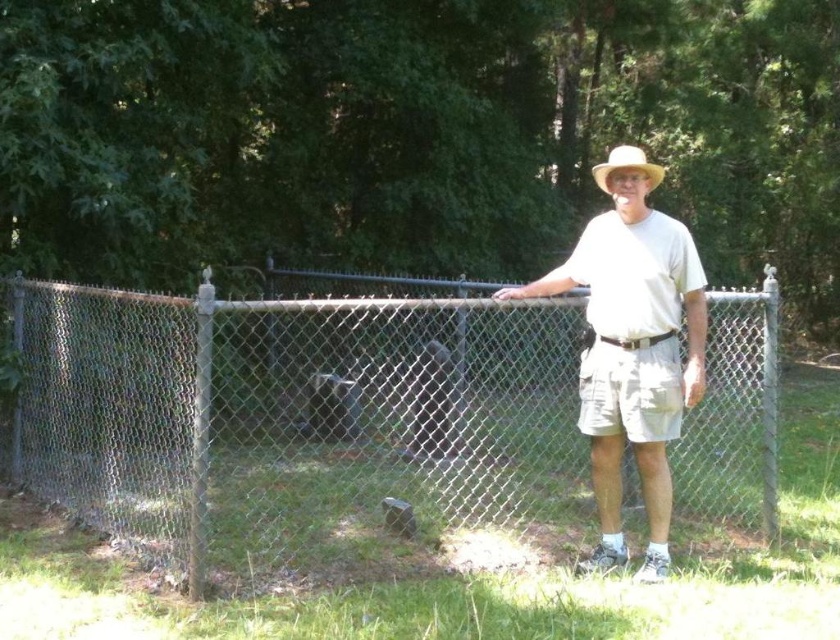
Question: From the image, what is the correct spatial relationship of silver chain-link fence at center in relation to white cotton shirt at center?

Choices:
 (A) above
 (B) below

Answer: (B)

Question: Which object is positioned farthest from the white cotton shirt at center?

Choices:
 (A) light brown straw hat at center
 (B) silver chain-link fence at center

Answer: (A)

Question: Is silver chain-link fence at center bigger than white cotton shirt at center?

Choices:
 (A) yes
 (B) no

Answer: (B)

Question: Which point is closer to the camera?

Choices:
 (A) white cotton shirt at center
 (B) silver chain-link fence at center
 (C) light brown straw hat at center

Answer: (C)

Question: Which object is closer to the camera taking this photo?

Choices:
 (A) white cotton shirt at center
 (B) light brown straw hat at center

Answer: (B)

Question: Can you confirm if silver chain-link fence at center is bigger than white cotton shirt at center?

Choices:
 (A) no
 (B) yes

Answer: (A)